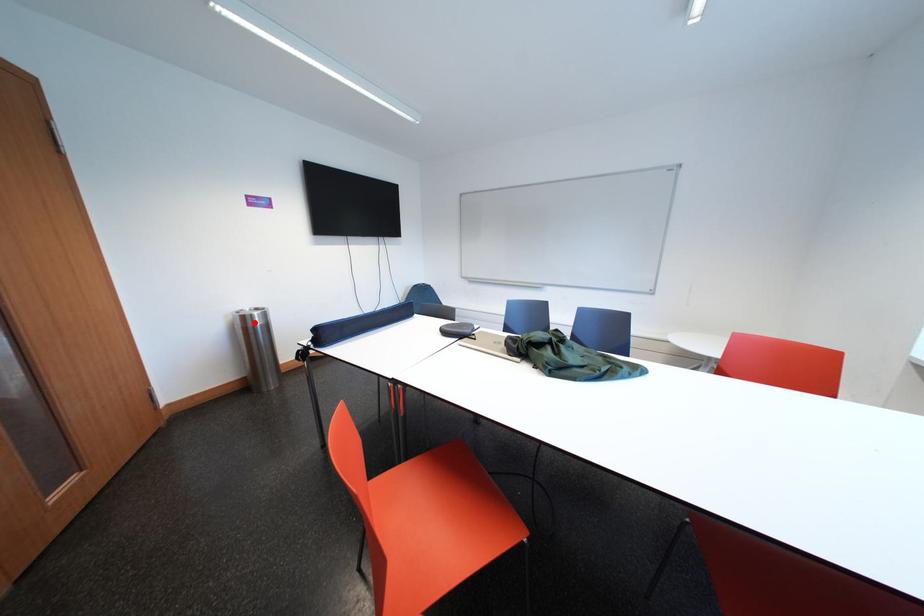
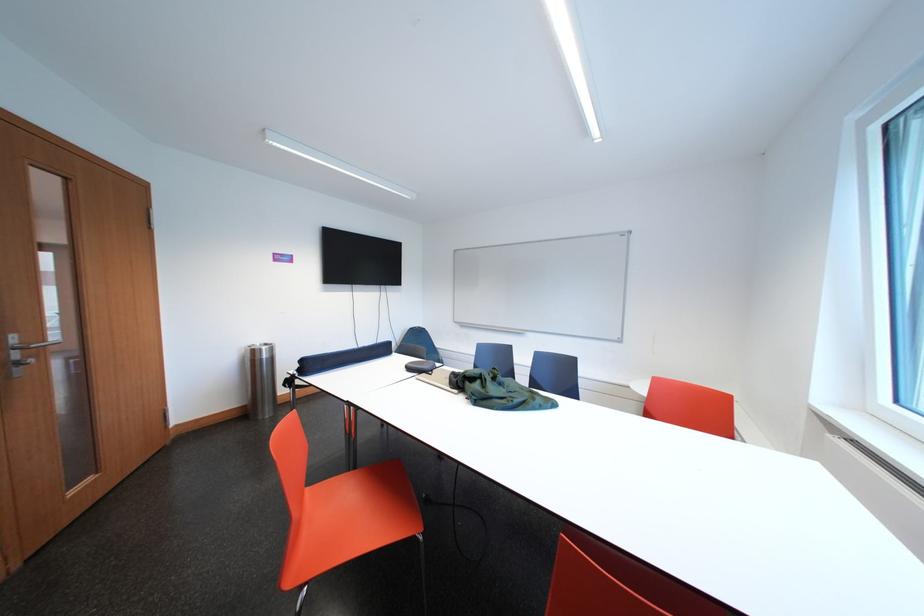
Question: I am providing you with two images of the same scene from different viewpoints. Given a red point in image1, look at the same physical point in image2. Is it:

Choices:
 (A) Closer to the viewpoint
 (B) Farther from the viewpoint

Answer: (B)